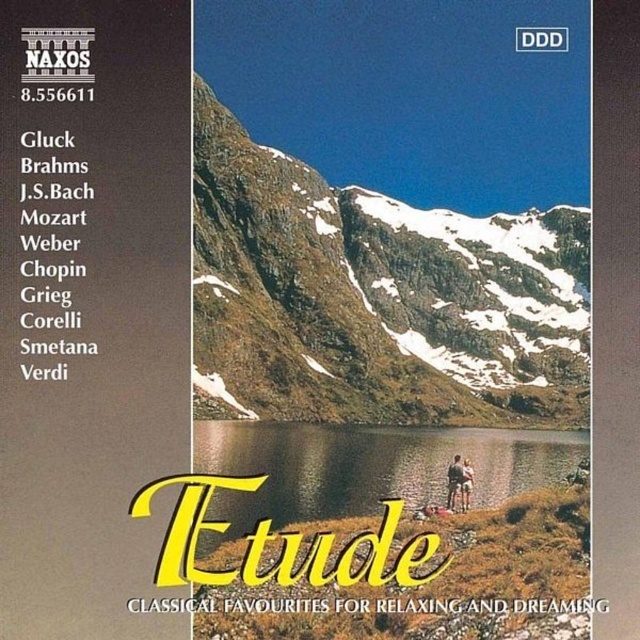
You are designing a digital album cover and need to place a new element at coordinates point 0.731, 0.575. The existing transparent water at center is already at that location. Can you place your new element there without overlapping?

The transparent water at center is already positioned at point (368, 467), so placing a new element there would overlap with it.

You are a photographer standing at point (452,481). You want to take a photo of the brown leather jacket at lower center. Is the jacket visible from your current position?

The brown leather jacket at lower center is located at point (452,481), so yes, it is visible from your current position.